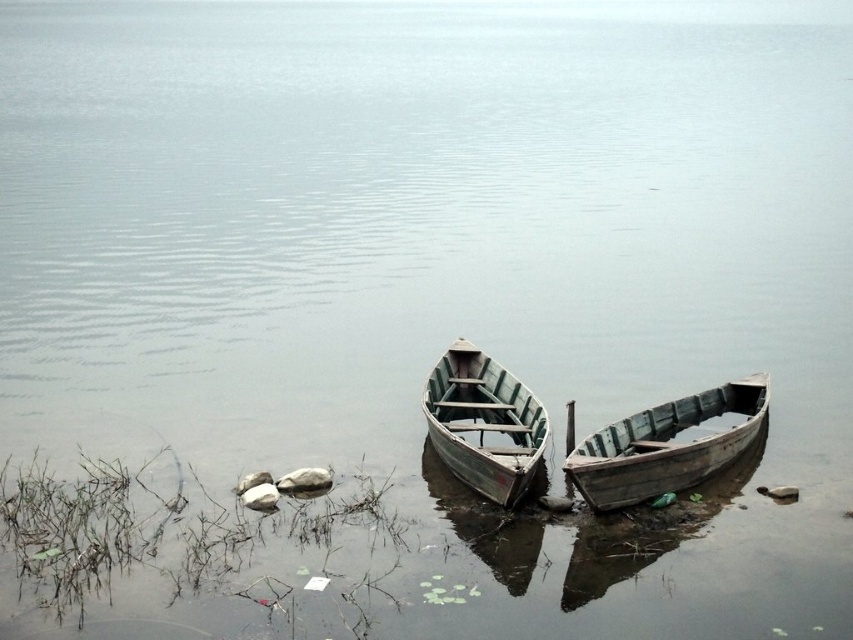
Measure the distance from wooden canoe at lower right to green wooden canoe at center.

wooden canoe at lower right and green wooden canoe at center are 2.22 meters apart from each other.

Which of these two, wooden canoe at lower right or green wooden canoe at center, stands taller?

Standing taller between the two is green wooden canoe at center.

Where is `wooden canoe at lower right`? The height and width of the screenshot is (640, 853). wooden canoe at lower right is located at coordinates (666, 445).